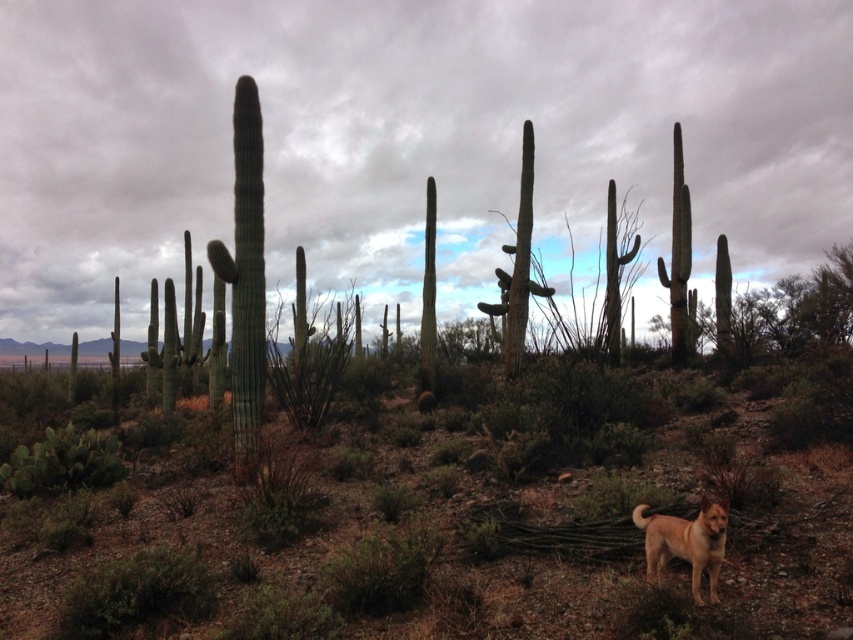
Question: Which of the following is the closest to the observer?

Choices:
 (A) (520, 433)
 (B) (717, 522)

Answer: (B)

Question: Among these objects, which one is farthest from the camera?

Choices:
 (A) green matte cactus at center
 (B) golden fur dog at lower right

Answer: (B)

Question: Can you confirm if green matte cactus at center is smaller than golden fur dog at lower right?

Choices:
 (A) no
 (B) yes

Answer: (A)

Question: Can you confirm if green matte cactus at center is thinner than golden fur dog at lower right?

Choices:
 (A) yes
 (B) no

Answer: (B)

Question: Can you confirm if green matte cactus at center is bigger than golden fur dog at lower right?

Choices:
 (A) no
 (B) yes

Answer: (B)